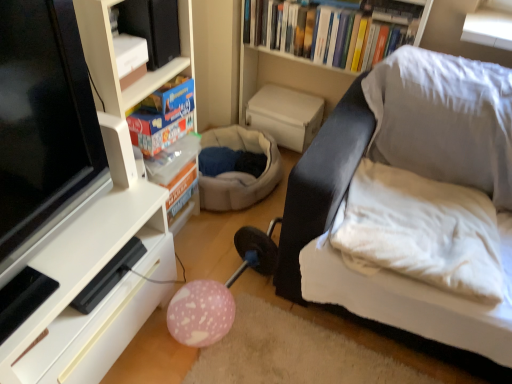
Question: Is white matte shelf at left, the 1th shelf when ordered from top to bottom, smaller than blue cardboard box at upper left, which is counted as the 2th book, starting from the right?

Choices:
 (A) no
 (B) yes

Answer: (A)

Question: Is the depth of white matte shelf at left, placed as the second shelf when sorted from bottom to top, greater than that of blue cardboard box at upper left, the first book in the left-to-right sequence?

Choices:
 (A) no
 (B) yes

Answer: (A)

Question: From a real-world perspective, is white matte shelf at left, placed as the second shelf when sorted from bottom to top, physically above blue cardboard box at upper left, which appears as the first book when viewed from the front?

Choices:
 (A) yes
 (B) no

Answer: (B)

Question: Is blue cardboard box at upper left, the first book in the left-to-right sequence, inside white matte shelf at left, the 1th shelf when ordered from top to bottom?

Choices:
 (A) no
 (B) yes

Answer: (B)

Question: Can you confirm if white matte shelf at left, placed as the second shelf when sorted from bottom to top, is wider than blue cardboard box at upper left, the first book in the left-to-right sequence?

Choices:
 (A) yes
 (B) no

Answer: (A)

Question: In the image, is white textured bookshelf at upper center positioned in front of or behind white soft pillow at right?

Choices:
 (A) behind
 (B) front

Answer: (A)

Question: Visually, is white textured bookshelf at upper center positioned to the left or to the right of white soft pillow at right?

Choices:
 (A) left
 (B) right

Answer: (A)

Question: In terms of width, does white textured bookshelf at upper center look wider or thinner when compared to white soft pillow at right?

Choices:
 (A) thin
 (B) wide

Answer: (A)

Question: Is white textured bookshelf at upper center taller or shorter than white soft pillow at right?

Choices:
 (A) tall
 (B) short

Answer: (A)

Question: Considering the positions of white matte shelf at left, the 1th shelf when ordered from top to bottom, and white soft pillow at right in the image, is white matte shelf at left, the 1th shelf when ordered from top to bottom, bigger or smaller than white soft pillow at right?

Choices:
 (A) small
 (B) big

Answer: (B)

Question: In terms of height, does white matte shelf at left, placed as the second shelf when sorted from bottom to top, look taller or shorter compared to white soft pillow at right?

Choices:
 (A) short
 (B) tall

Answer: (B)

Question: From the image's perspective, is white matte shelf at left, the 1th shelf when ordered from top to bottom, located above or below white soft pillow at right?

Choices:
 (A) above
 (B) below

Answer: (A)

Question: In the image, is white matte shelf at left, the 1th shelf when ordered from top to bottom, positioned in front of or behind white soft pillow at right?

Choices:
 (A) behind
 (B) front

Answer: (B)

Question: Would you say white textured bookshelf at upper center is to the left or to the right of blue cardboard box at upper left, the 2th book from the back, in the picture?

Choices:
 (A) left
 (B) right

Answer: (B)

Question: In terms of width, does white textured bookshelf at upper center look wider or thinner when compared to blue cardboard box at upper left, which ranks as the 1th book in bottom-to-top order?

Choices:
 (A) thin
 (B) wide

Answer: (B)